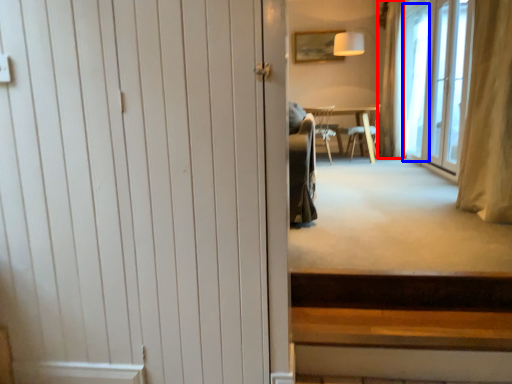
Question: Which object is further to the camera taking this photo, curtain (highlighted by a red box) or window screen (highlighted by a blue box)?

Choices:
 (A) curtain
 (B) window screen

Answer: (A)